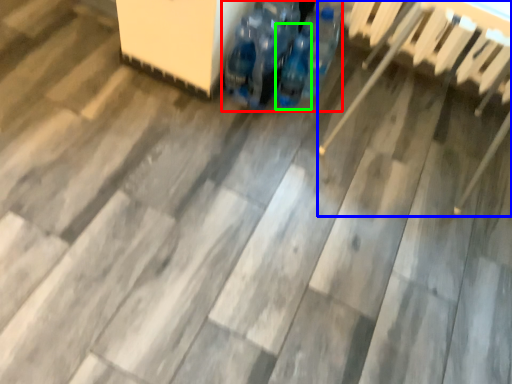
Question: Which is nearer to the footwear (highlighted by a red box)? chair (highlighted by a blue box) or bottle (highlighted by a green box).

Choices:
 (A) chair
 (B) bottle

Answer: (B)